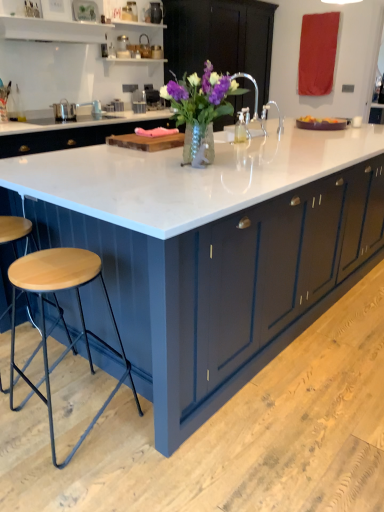
This screenshot has width=384, height=512. Find the location of `free space in front of translucent glass vase with purple flowers at center`. free space in front of translucent glass vase with purple flowers at center is located at coordinates (205, 182).